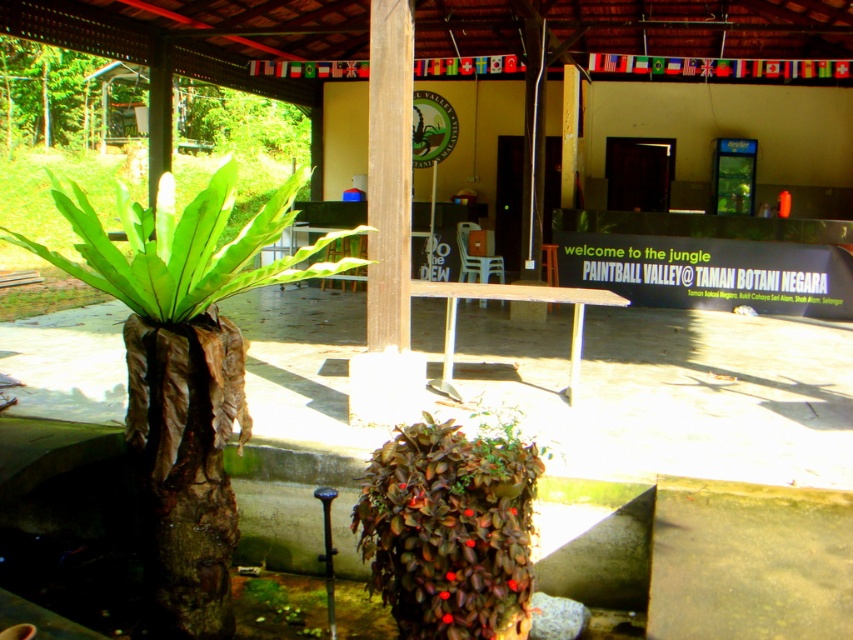
Question: Which point is farther to the camera?

Choices:
 (A) (451, 632)
 (B) (173, 627)

Answer: (B)

Question: Can you confirm if green leafy plant at left is positioned to the left of leathery brown plant at center?

Choices:
 (A) no
 (B) yes

Answer: (B)

Question: Does green leafy plant at left have a greater width compared to leathery brown plant at center?

Choices:
 (A) yes
 (B) no

Answer: (A)

Question: Does green leafy plant at left have a larger size compared to leathery brown plant at center?

Choices:
 (A) no
 (B) yes

Answer: (B)

Question: Which point appears farthest from the camera in this image?

Choices:
 (A) (310, 268)
 (B) (453, 497)

Answer: (A)

Question: Which of the following is the closest to the observer?

Choices:
 (A) (416, 460)
 (B) (183, 460)

Answer: (A)